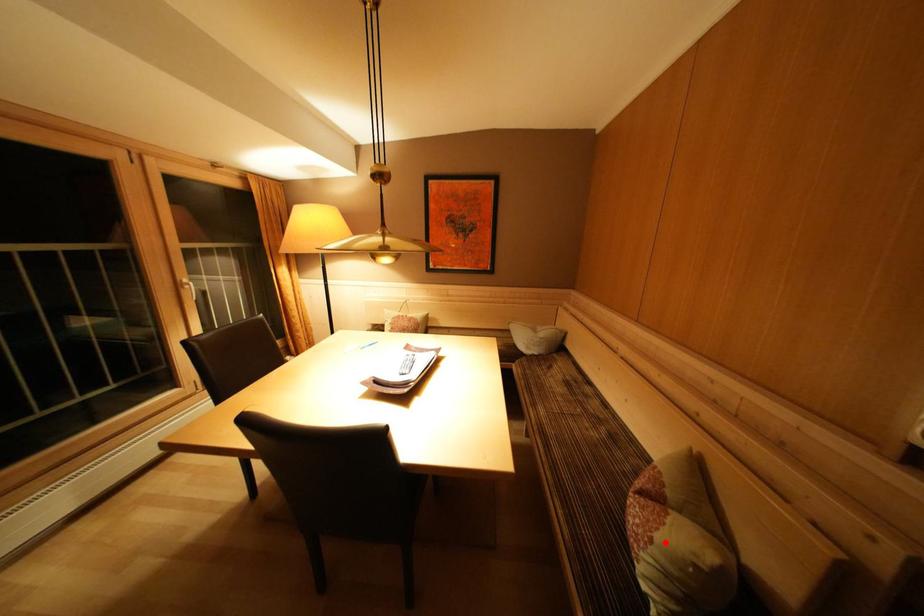
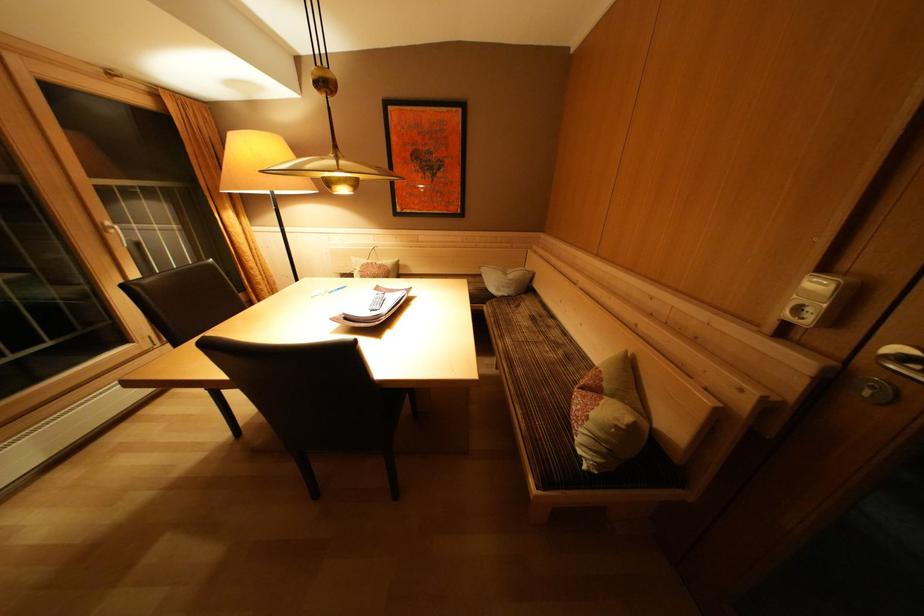
Find the pixel in the second image that matches the highlighted location in the first image.

(600, 419)